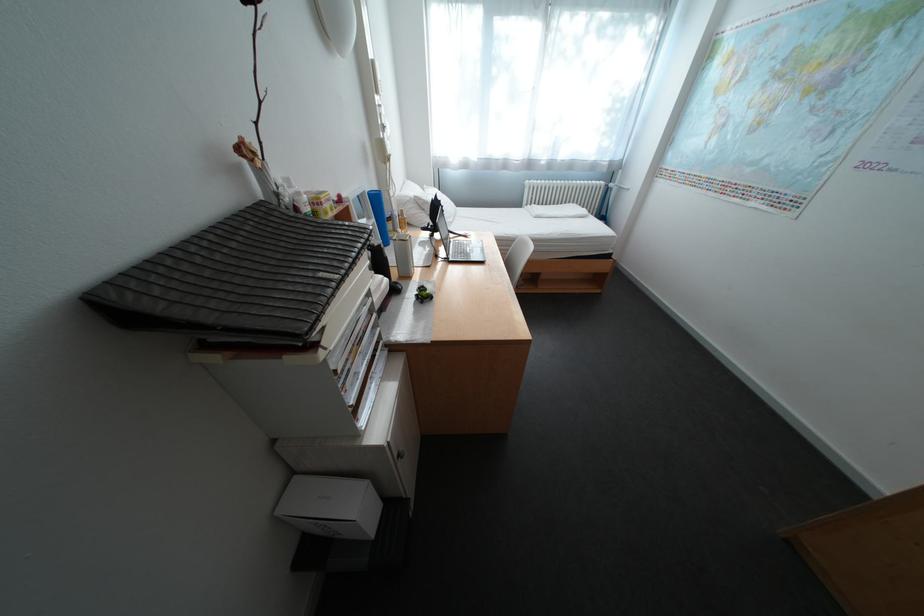
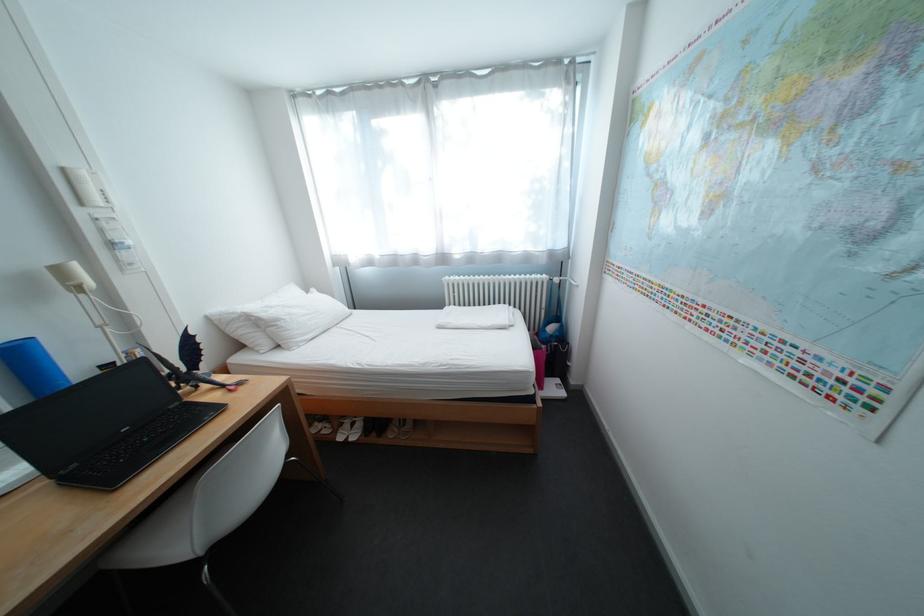
Where in the second image is the point corresponding to point (624, 253) from the first image?

(544, 392)